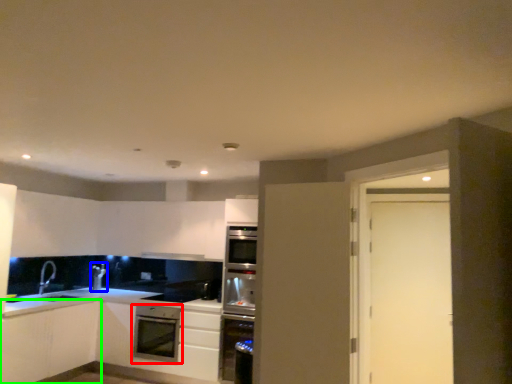
Question: Which is nearer to the kitchen appliance (highlighted by a red box)? appliance (highlighted by a blue box) or cabinetry (highlighted by a green box).

Choices:
 (A) appliance
 (B) cabinetry

Answer: (B)